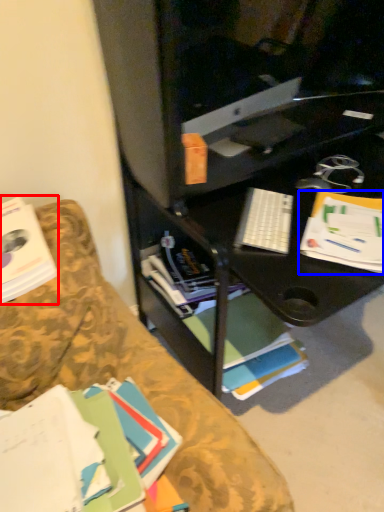
Question: Among these objects, which one is farthest to the camera, book (highlighted by a red box) or paperback book (highlighted by a blue box)?

Choices:
 (A) book
 (B) paperback book

Answer: (B)